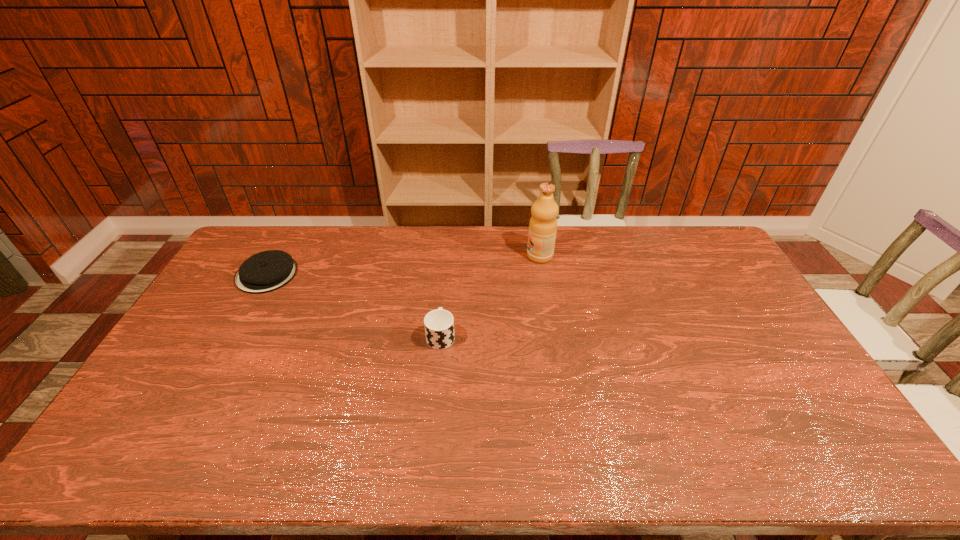
This screenshot has height=540, width=960. I want to click on free region at the near left corner of the desktop, so (114, 471).

This screenshot has height=540, width=960. What are the coordinates of `free space between the second object from right to left and the leftmost object` in the screenshot? It's located at (354, 305).

The width and height of the screenshot is (960, 540). I want to click on vacant space that's between the shortest object and the tallest object, so click(x=403, y=265).

Image resolution: width=960 pixels, height=540 pixels. Identify the location of empty space that is in between the cup and the leftmost object. (354, 305).

This screenshot has width=960, height=540. In order to click on free area in between the fruit juice and the leftmost object in this screenshot , I will do `click(403, 265)`.

Locate an element on the screen. vacant area that lies between the rightmost object and the second shortest object is located at coordinates (491, 296).

I want to click on free space between the nearest object and the shortest object, so click(x=354, y=305).

This screenshot has height=540, width=960. I want to click on free space between the nearest object and the shortest object, so [354, 305].

Image resolution: width=960 pixels, height=540 pixels. What are the coordinates of `free spot between the cup and the pancake` in the screenshot? It's located at (354, 305).

This screenshot has height=540, width=960. What are the coordinates of `vacant space that's between the rightmost object and the leftmost object` in the screenshot? It's located at click(x=403, y=265).